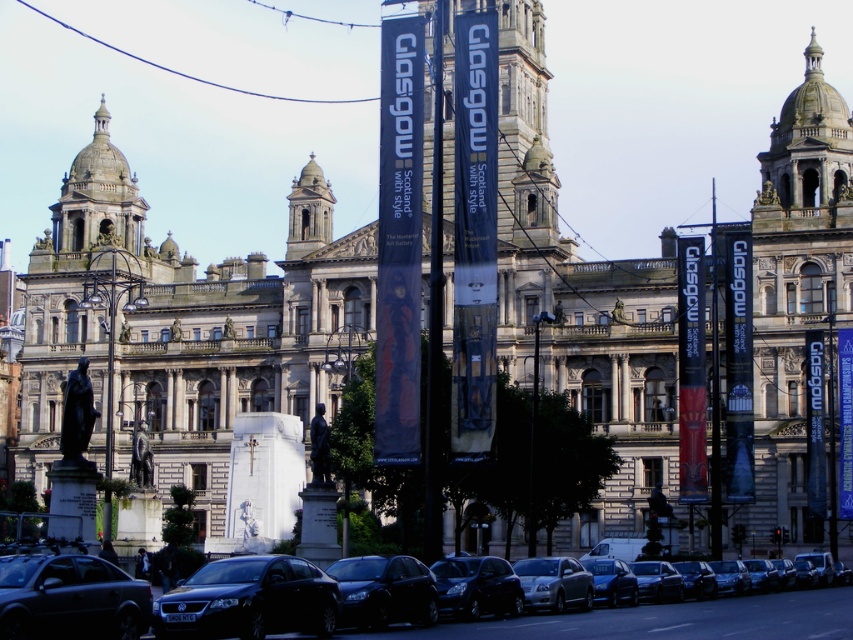
You are a photographer trying to capture the grand historic building in Glasgow. You notice two cars parked at the center of the scene, a shiny black car at center and a silver metallic sedan at center. Which car is blocking the view of the other car?

The shiny black car at center is positioned over silver metallic sedan at center, so it is blocking the view of the silver metallic sedan at center.

You are a photographer planning to take a photo of the polished stone tower at upper right and the shiny black sedan at lower left. Which object should you focus on first if you want to capture both in the same frame without moving the camera?

The polished stone tower at upper right is taller than the shiny black sedan at lower left, so you should focus on the polished stone tower at upper right first to ensure it fits within the frame.